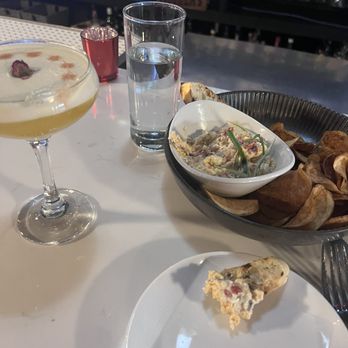
Locate an element on the screen. Image resolution: width=348 pixels, height=348 pixels. plate is located at coordinates (167, 308).